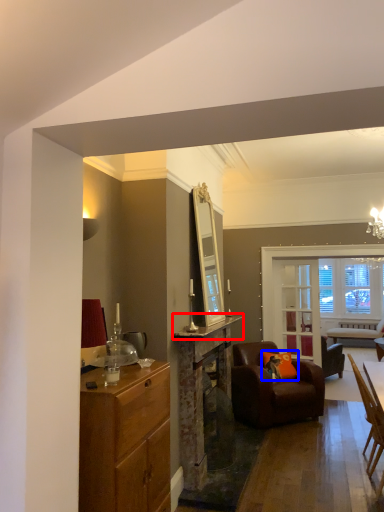
Question: Among these objects, which one is farthest to the camera, counter top (highlighted by a red box) or pillow (highlighted by a blue box)?

Choices:
 (A) counter top
 (B) pillow

Answer: (B)